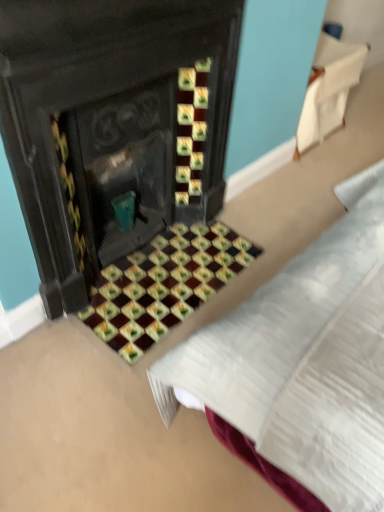
Find the location of a particular element. The width and height of the screenshot is (384, 512). white fabric at upper right is located at coordinates (328, 89).

What do you see at coordinates (328, 89) in the screenshot? This screenshot has height=512, width=384. I see `white fabric at upper right` at bounding box center [328, 89].

What do you see at coordinates (163, 284) in the screenshot? This screenshot has width=384, height=512. I see `marble mosaic tiles at center` at bounding box center [163, 284].

Find the location of a particular element. Image resolution: width=384 pixels, height=512 pixels. marble mosaic tiles at center is located at coordinates (163, 284).

Looking at this image, what is the approximate width of marble mosaic tiles at center?

marble mosaic tiles at center is 17.75 inches wide.

Find the location of a particular element. This screenshot has width=384, height=512. white fabric at upper right is located at coordinates (328, 89).

Between marble mosaic tiles at center and white fabric at upper right, which one appears on the right side from the viewer's perspective?

white fabric at upper right.

Which is behind, marble mosaic tiles at center or white fabric at upper right?

white fabric at upper right is more distant.

Which is in front, point (170, 312) or point (322, 138)?

The point (170, 312) is more forward.

From the image's perspective, which is above, marble mosaic tiles at center or white fabric at upper right?

white fabric at upper right, from the image's perspective.

From a real-world perspective, which object stands above the other?

From a 3D spatial view, white fabric at upper right is above.

Can you confirm if marble mosaic tiles at center is wider than white fabric at upper right?

Yes.

Considering the relative sizes of marble mosaic tiles at center and white fabric at upper right in the image provided, is marble mosaic tiles at center shorter than white fabric at upper right?

Yes, marble mosaic tiles at center is shorter than white fabric at upper right.

Considering the sizes of objects marble mosaic tiles at center and white fabric at upper right in the image provided, who is bigger, marble mosaic tiles at center or white fabric at upper right?

white fabric at upper right is bigger.

Can white fabric at upper right be found inside marble mosaic tiles at center?

No, white fabric at upper right is not surrounded by marble mosaic tiles at center.

Is marble mosaic tiles at center far away from white fabric at upper right?

marble mosaic tiles at center is positioned a significant distance from white fabric at upper right.

Is marble mosaic tiles at center facing towards white fabric at upper right?

No, marble mosaic tiles at center is not turned towards white fabric at upper right.

This screenshot has height=512, width=384. In order to click on furniture on the right of the marble mosaic tiles at center in this screenshot , I will do `click(328, 89)`.

Does white fabric at upper right appear on the left side of marble mosaic tiles at center?

No, white fabric at upper right is not to the left of marble mosaic tiles at center.

Relative to marble mosaic tiles at center, is white fabric at upper right in front or behind?

Visually, white fabric at upper right is located behind marble mosaic tiles at center.

Is point (325, 38) closer to camera compared to point (113, 267)?

No.

From the image's perspective, which is below, white fabric at upper right or marble mosaic tiles at center?

marble mosaic tiles at center appears lower in the image.

From a real-world perspective, which is physically above, white fabric at upper right or marble mosaic tiles at center?

white fabric at upper right, from a real-world perspective.

Between white fabric at upper right and marble mosaic tiles at center, which one has larger width?

marble mosaic tiles at center is wider.

Which of these two, white fabric at upper right or marble mosaic tiles at center, stands shorter?

With less height is marble mosaic tiles at center.

Based on their sizes in the image, would you say white fabric at upper right is bigger or smaller than marble mosaic tiles at center?

white fabric at upper right is bigger than marble mosaic tiles at center.

Can we say white fabric at upper right lies outside marble mosaic tiles at center?

Indeed, white fabric at upper right is completely outside marble mosaic tiles at center.

Is white fabric at upper right positioned far away from marble mosaic tiles at center?

Yes.

Could you tell me if white fabric at upper right is facing marble mosaic tiles at center?

No, white fabric at upper right is not oriented towards marble mosaic tiles at center.

What are the coordinates of `pattern below the white fabric at upper right (from a real-world perspective)` in the screenshot? It's located at (163, 284).

In the image, there is a marble mosaic tiles at center. Where is `furniture above it (from the image's perspective)`? furniture above it (from the image's perspective) is located at coordinates (328, 89).

I want to click on pattern located in front of the white fabric at upper right, so click(163, 284).